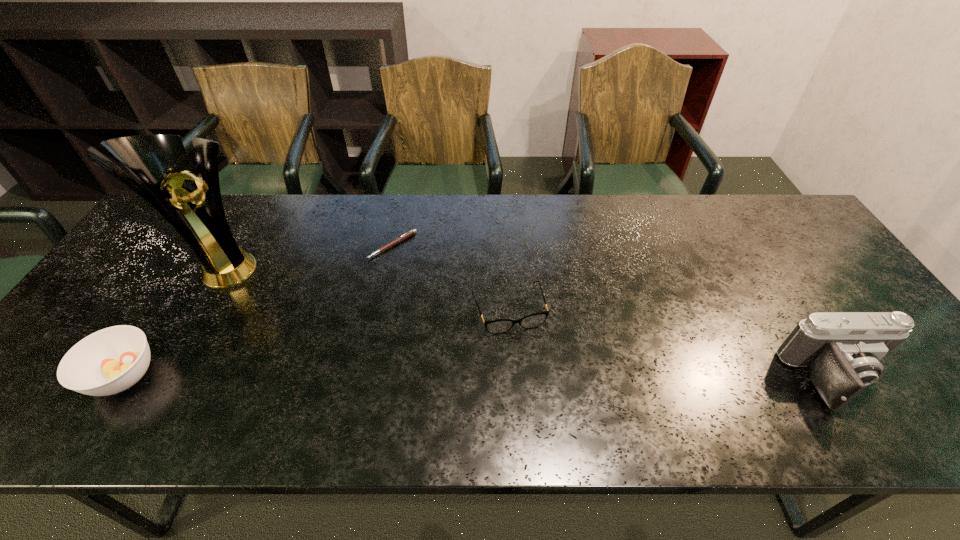
The height and width of the screenshot is (540, 960). I want to click on free space that satisfies the following two spatial constraints: 1. on the front side of the fourth object from left to right; 2. on the left side of the tallest object, so click(x=195, y=310).